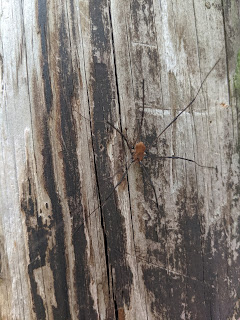
The image size is (240, 320). Find the location of `light areas of wood`. light areas of wood is located at coordinates (201, 63), (13, 110), (44, 276), (66, 216), (88, 190), (127, 206).